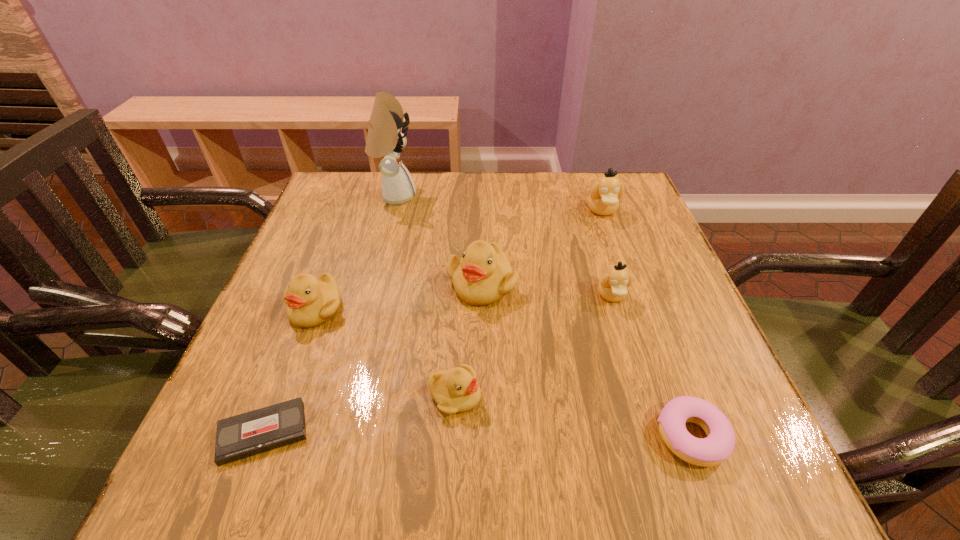
Find the location of `vacant space located on the back of the videotape`. vacant space located on the back of the videotape is located at coordinates (316, 296).

Where is `doll that is at the far edge`? This screenshot has height=540, width=960. doll that is at the far edge is located at coordinates (386, 137).

This screenshot has height=540, width=960. I want to click on duckling present at the far edge, so click(x=603, y=199).

At what (x,y) coordinates should I click in order to perform the action: click on doughnut at the near edge. Please return your answer as a coordinate pair (x, y). Looking at the image, I should click on (716, 448).

Locate an element on the screen. videotape present at the near edge is located at coordinates (244, 435).

Locate an element on the screen. The width and height of the screenshot is (960, 540). doll present at the left edge is located at coordinates tap(386, 137).

Find the location of a particular element. The width and height of the screenshot is (960, 540). duckling that is at the left edge is located at coordinates (310, 301).

The height and width of the screenshot is (540, 960). Find the location of `videotape that is at the left edge`. videotape that is at the left edge is located at coordinates (244, 435).

At what (x,y) coordinates should I click in order to perform the action: click on doughnut at the right edge. Please return your answer as a coordinate pair (x, y). Looking at the image, I should click on (716, 448).

The image size is (960, 540). In order to click on object present at the far left corner in this screenshot , I will do `click(386, 137)`.